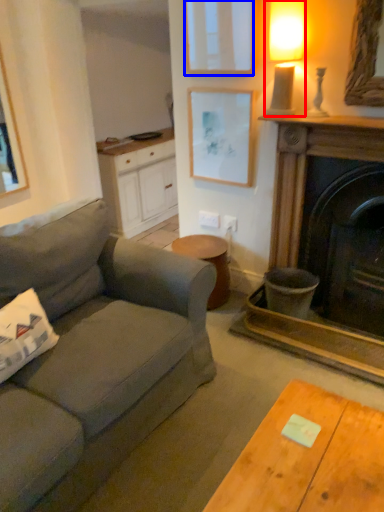
Question: Which object is closer to the camera taking this photo, lamp (highlighted by a red box) or picture frame (highlighted by a blue box)?

Choices:
 (A) lamp
 (B) picture frame

Answer: (A)